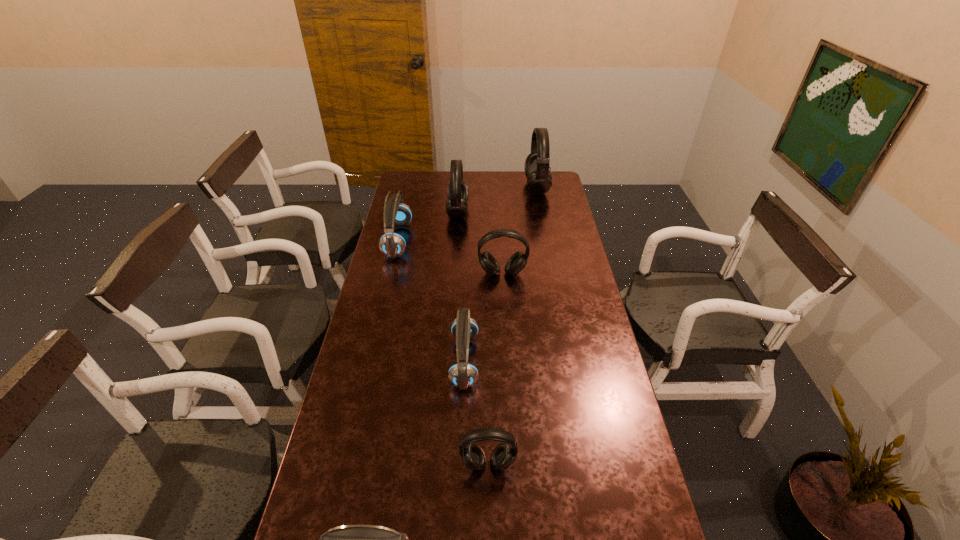
Select which object is the third closest to the third smallest gray headset. Please provide its 2D coordinates. Your answer should be formatted as a tuple, i.e. [(x, y)], where the tuple contains the x and y coordinates of a point satisfying the conditions above.

[(516, 263)]

The height and width of the screenshot is (540, 960). Find the location of `object that stands as the closest to the rightmost gray headset`. object that stands as the closest to the rightmost gray headset is located at coordinates (457, 193).

Identify the location of the fourth closest headset to the nearest gray headset. (392, 244).

Locate an element on the screen. The width and height of the screenshot is (960, 540). headset object that ranks as the sixth closest to the nearest blue headset is located at coordinates (539, 179).

Select which gray headset is the closest to the fourth nearest object. Please provide its 2D coordinates. Your answer should be formatted as a tuple, i.e. [(x, y)], where the tuple contains the x and y coordinates of a point satisfying the conditions above.

[(457, 193)]

Identify the location of gray headset that stands as the closest to the nearest gray headset. (516, 263).

Locate which blue headset is the third closest to the second biggest gray headset. Please provide its 2D coordinates. Your answer should be formatted as a tuple, i.e. [(x, y)], where the tuple contains the x and y coordinates of a point satisfying the conditions above.

[(354, 539)]

Locate which blue headset is the closest to the nearest headset. Please provide its 2D coordinates. Your answer should be formatted as a tuple, i.e. [(x, y)], where the tuple contains the x and y coordinates of a point satisfying the conditions above.

[(462, 374)]

Locate an element on the screen. free point that satisfies the following two spatial constraints: 1. on the earcups of the rightmost object; 2. on the earcups of the smallest gray headset is located at coordinates (589, 464).

Identify the location of free region that satisfies the following two spatial constraints: 1. on the earcups of the biggest gray headset; 2. on the earcups of the sixth farthest headset. (589, 464).